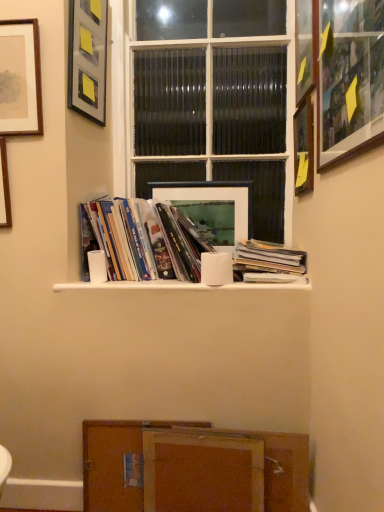
Question: Does point (294, 120) appear closer or farther from the camera than point (76, 109)?

Choices:
 (A) closer
 (B) farther

Answer: (B)

Question: From a real-world perspective, is wooden picture frame at upper right, which is counted as the seventh picture frame, starting from the left, physically located above or below metallic gray picture frame at upper left, arranged as the third picture frame when viewed from the left?

Choices:
 (A) above
 (B) below

Answer: (B)

Question: Which is farther from the wooden picture frame at upper right, the third picture frame from the right?

Choices:
 (A) wooden picture frame at upper right, the first picture frame positioned from the right
 (B) wooden picture frame at upper right, positioned as the second picture frame in right-to-left order
 (C) matte black picture frame at center, which is counted as the 4th picture frame, starting from the left
 (D) matte glass window at center
 (E) hardcover books at center, arranged as the 1th book when viewed from the left

Answer: (C)

Question: Which object is positioned closest to the wooden cabinet at lower center?

Choices:
 (A) matte black picture frame at center, the 4th picture frame when ordered from right to left
 (B) wooden picture frame at upper right, which is the 6th picture frame in left-to-right order
 (C) wooden picture frame at upper right, which appears as the fifth picture frame when viewed from the left
 (D) wooden picture frame at left, the 7th picture frame in the right-to-left sequence
 (E) matte black picture frame at upper left, acting as the second picture frame starting from the left

Answer: (A)